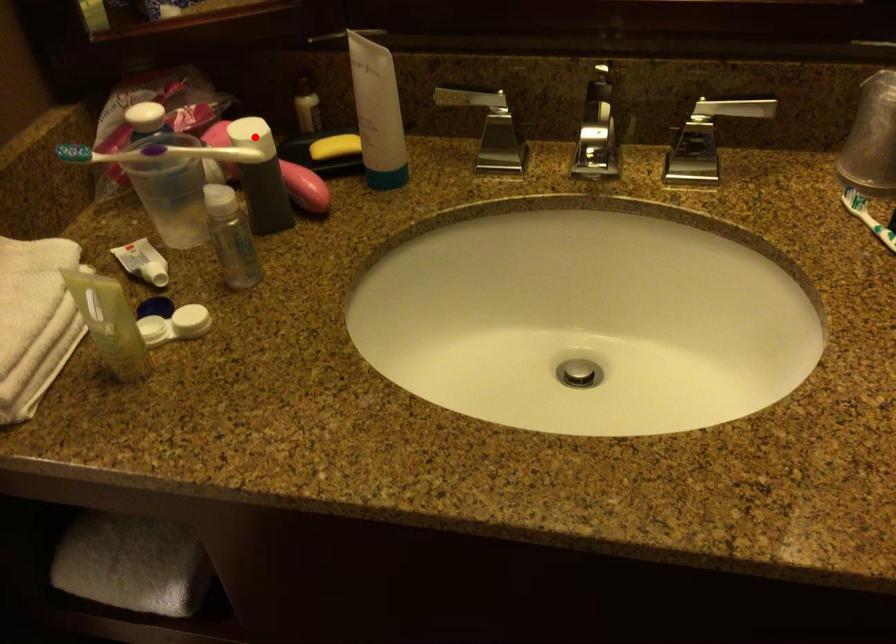
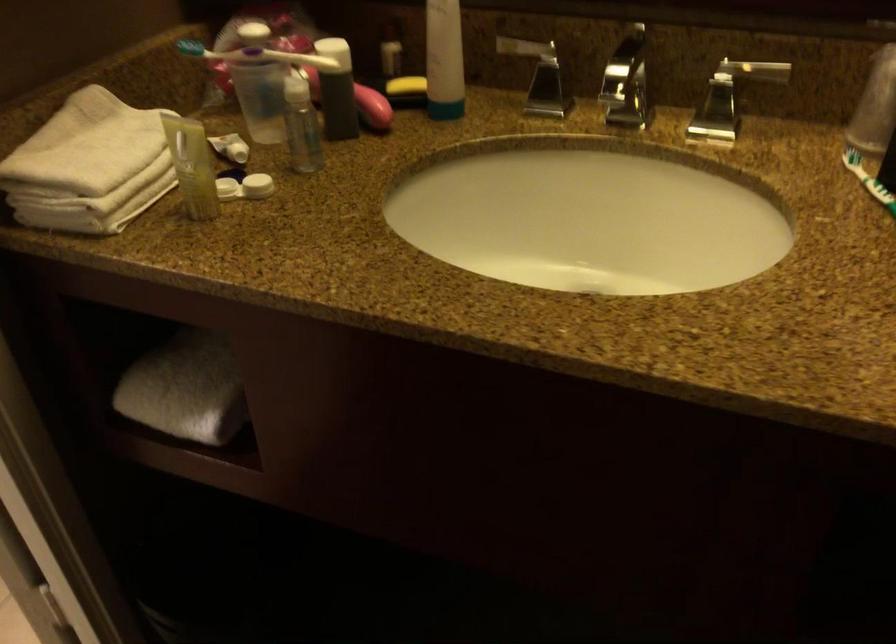
In the second image, find the point that corresponds to the highlighted location in the first image.

(334, 52)